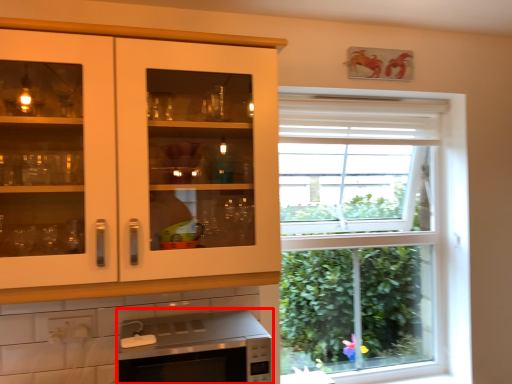
Question: In this image, where is microwave oven (annotated by the red box) located relative to cabinetry?

Choices:
 (A) right
 (B) left

Answer: (A)